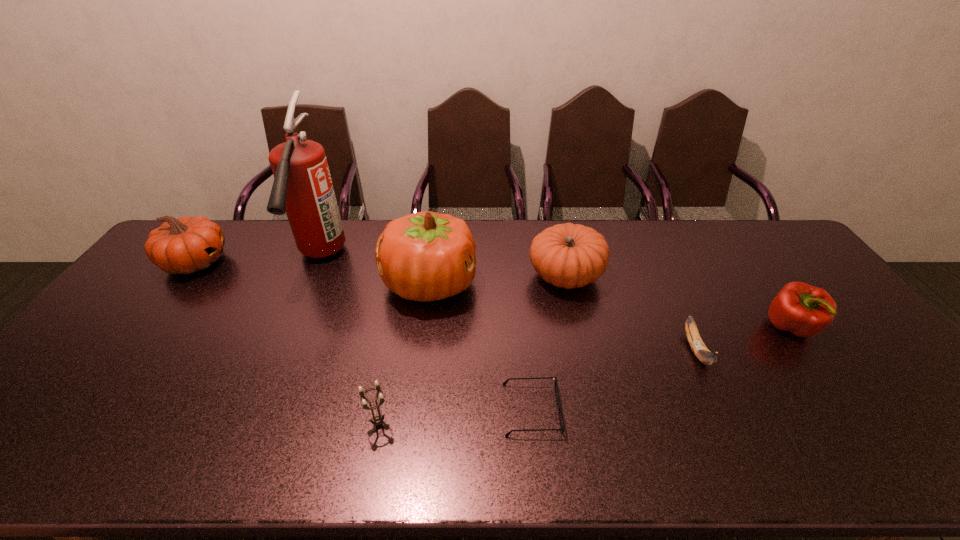
Image resolution: width=960 pixels, height=540 pixels. I want to click on free space between the second object from left to right and the rightmost object, so click(556, 293).

The height and width of the screenshot is (540, 960). Identify the location of free space between the banana and the spectacles. (613, 380).

You are a GUI agent. You are given a task and a screenshot of the screen. Output one action in this format:
    pyautogui.click(x=<x>, y=<y>)
    Task: Click on the free space between the leftmost pumpkin and the tallest pumpkin
    The width and height of the screenshot is (960, 540).
    Given the screenshot: What is the action you would take?
    pyautogui.click(x=313, y=273)

Locate an element on the screen. This screenshot has width=960, height=540. vacant space that's between the rightmost pumpkin and the bell pepper is located at coordinates (679, 301).

What are the coordinates of `vacant space that is in between the seventh shortest object and the rightmost pumpkin` in the screenshot? It's located at (497, 279).

Where is `vacant area that lies between the rightmost pumpkin and the candle holder`? Image resolution: width=960 pixels, height=540 pixels. vacant area that lies between the rightmost pumpkin and the candle holder is located at coordinates (472, 349).

Locate an element on the screen. Image resolution: width=960 pixels, height=540 pixels. free space between the candle holder and the leftmost object is located at coordinates (287, 343).

Identify the location of free space between the candle holder and the seventh object from right to left. This screenshot has width=960, height=540. (349, 340).

You are a GUI agent. You are given a task and a screenshot of the screen. Output one action in this format:
    pyautogui.click(x=<x>, y=<y>)
    Task: Click on the vacant point located between the leftmost object and the second object from left to right
    Image resolution: width=960 pixels, height=540 pixels.
    Given the screenshot: What is the action you would take?
    pyautogui.click(x=258, y=260)

Identify the location of free space between the leftmost pumpkin and the second object from left to right. (258, 260).